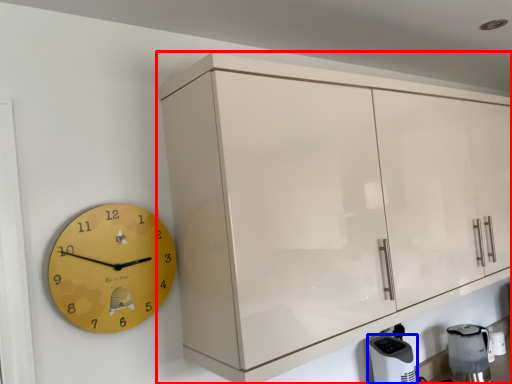
Question: Which point is further to the camera, cabinetry (highlighted by a red box) or appliance (highlighted by a blue box)?

Choices:
 (A) cabinetry
 (B) appliance

Answer: (B)